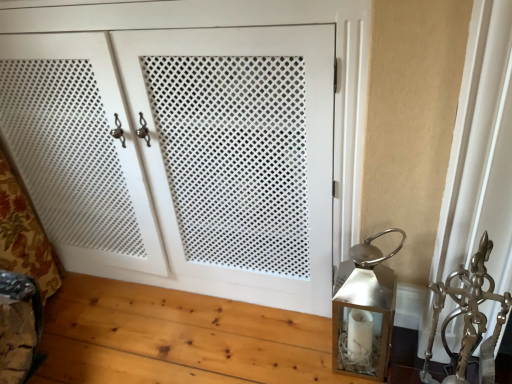
Question: Is metallic silver sculpture at right wider than white matte cabinet doors at center?

Choices:
 (A) yes
 (B) no

Answer: (B)

Question: Can you confirm if metallic silver sculpture at right is thinner than white matte cabinet doors at center?

Choices:
 (A) yes
 (B) no

Answer: (A)

Question: Is metallic silver sculpture at right shorter than white matte cabinet doors at center?

Choices:
 (A) no
 (B) yes

Answer: (B)

Question: Is metallic silver sculpture at right far away from white matte cabinet doors at center?

Choices:
 (A) yes
 (B) no

Answer: (B)

Question: Does metallic silver sculpture at right have a greater height compared to white matte cabinet doors at center?

Choices:
 (A) no
 (B) yes

Answer: (A)

Question: Is metallic silver sculpture at right aimed at white matte cabinet doors at center?

Choices:
 (A) yes
 (B) no

Answer: (B)

Question: Is silver metallic lantern at right at the left side of white matte cabinet doors at center?

Choices:
 (A) yes
 (B) no

Answer: (B)

Question: From a real-world perspective, is silver metallic lantern at right below white matte cabinet doors at center?

Choices:
 (A) no
 (B) yes

Answer: (B)

Question: Considering the relative sizes of silver metallic lantern at right and white matte cabinet doors at center in the image provided, is silver metallic lantern at right smaller than white matte cabinet doors at center?

Choices:
 (A) yes
 (B) no

Answer: (A)

Question: Does silver metallic lantern at right have a greater height compared to white matte cabinet doors at center?

Choices:
 (A) no
 (B) yes

Answer: (A)

Question: Considering the relative sizes of silver metallic lantern at right and white matte cabinet doors at center in the image provided, is silver metallic lantern at right wider than white matte cabinet doors at center?

Choices:
 (A) no
 (B) yes

Answer: (A)

Question: From the image's perspective, is silver metallic lantern at right located above white matte cabinet doors at center?

Choices:
 (A) yes
 (B) no

Answer: (B)

Question: Can you confirm if white matte cabinet doors at center is thinner than metallic silver sculpture at right?

Choices:
 (A) yes
 (B) no

Answer: (B)